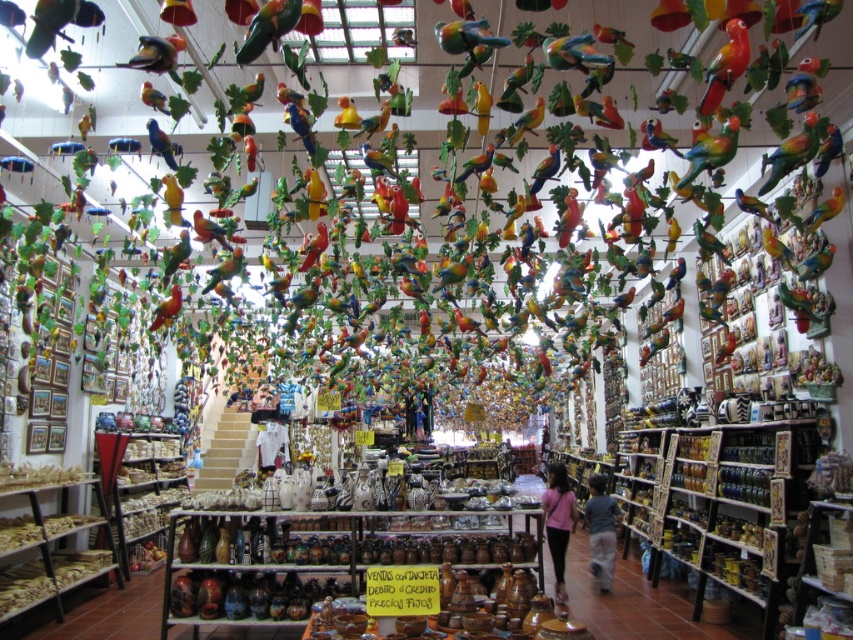
Question: Does shiny multicolored parrot at upper right appear under matte blue parrot at upper center?

Choices:
 (A) yes
 (B) no

Answer: (B)

Question: Is the position of shiny multicolored parrot at upper right less distant than that of matte blue parrot at upper center?

Choices:
 (A) yes
 (B) no

Answer: (A)

Question: Which object is farther from the camera taking this photo?

Choices:
 (A) shiny multicolored parrot at upper right
 (B) matte blue parrot at upper center

Answer: (B)

Question: Is the position of shiny multicolored parrot at upper right less distant than that of matte blue parrot at upper center?

Choices:
 (A) no
 (B) yes

Answer: (B)